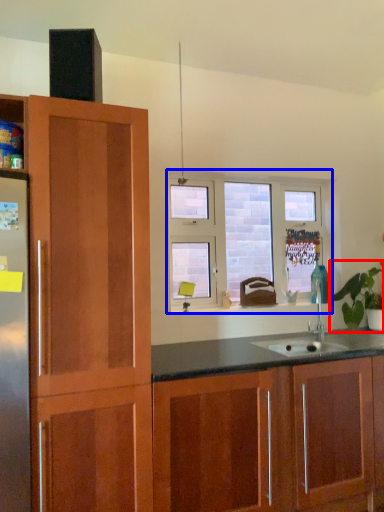
Question: Among these objects, which one is farthest to the camera, houseplant (highlighted by a red box) or window (highlighted by a blue box)?

Choices:
 (A) houseplant
 (B) window

Answer: (B)